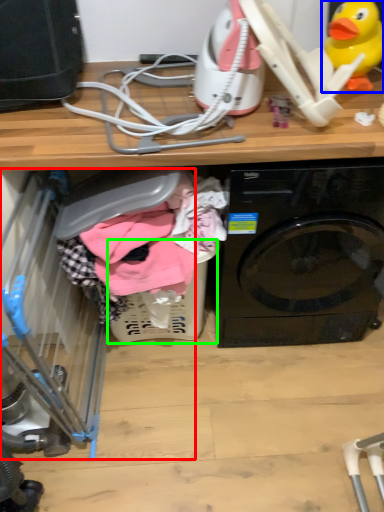
Question: Estimate the real-world distances between objects in this image. Which object is farther from baby carriage (highlighted by a red box), toy (highlighted by a blue box) or basket (highlighted by a green box)?

Choices:
 (A) toy
 (B) basket

Answer: (A)